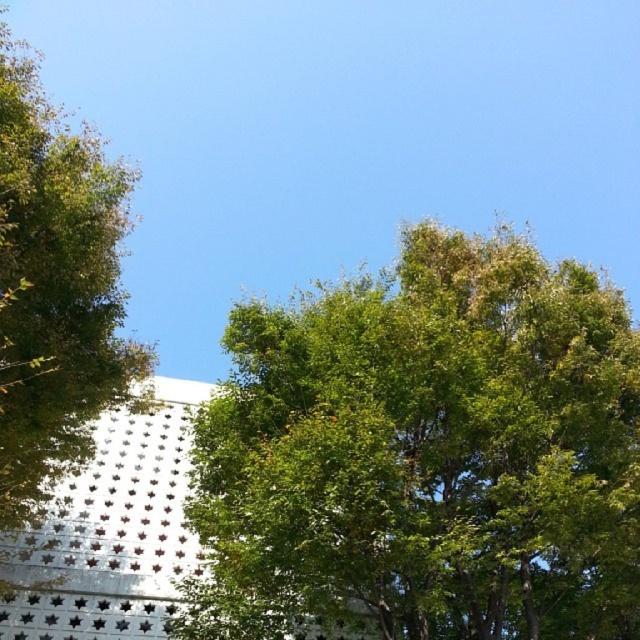
Is green leafy tree at center taller than green leafy tree at left?

In fact, green leafy tree at center may be shorter than green leafy tree at left.

Identify the location of green leafy tree at center. (422, 456).

The width and height of the screenshot is (640, 640). In order to click on green leafy tree at center in this screenshot , I will do `click(422, 456)`.